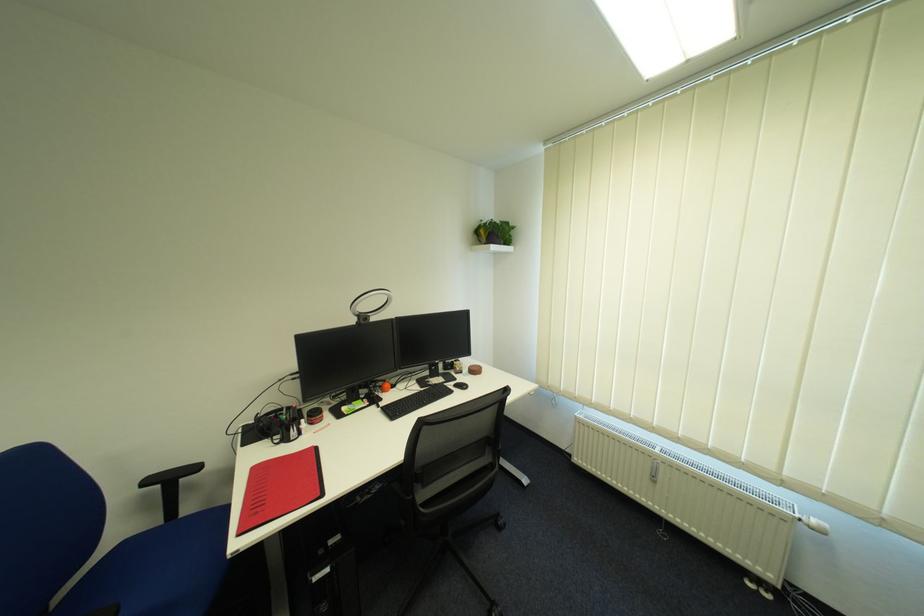
Where is `red binder`? The height and width of the screenshot is (616, 924). red binder is located at coordinates (281, 488).